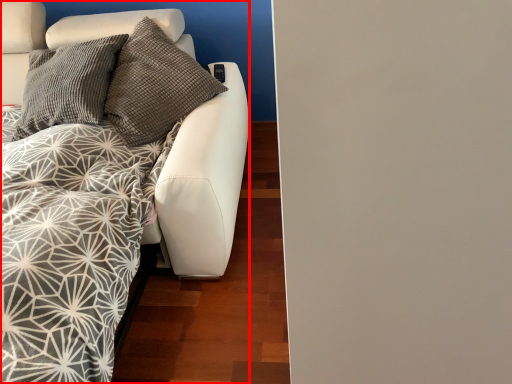
Question: From the image's perspective, what is the correct spatial relationship of furniture (annotated by the red box) in relation to backdrop?

Choices:
 (A) below
 (B) above

Answer: (A)